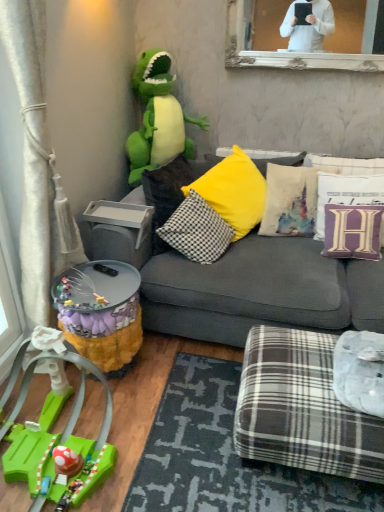
Question: Does dark gray textured mat at lower center have a larger size compared to purple velvet pillow at upper right, arranged as the fourth pillow when viewed from the left?

Choices:
 (A) yes
 (B) no

Answer: (A)

Question: From a real-world perspective, is dark gray textured mat at lower center beneath purple velvet pillow at upper right, the first pillow from the right?

Choices:
 (A) yes
 (B) no

Answer: (A)

Question: Is dark gray textured mat at lower center not inside purple velvet pillow at upper right, the first pillow from the right?

Choices:
 (A) no
 (B) yes

Answer: (B)

Question: Can purple velvet pillow at upper right, arranged as the fourth pillow when viewed from the left, be found inside dark gray textured mat at lower center?

Choices:
 (A) yes
 (B) no

Answer: (B)

Question: Can you confirm if dark gray textured mat at lower center is shorter than purple velvet pillow at upper right, arranged as the fourth pillow when viewed from the left?

Choices:
 (A) yes
 (B) no

Answer: (A)

Question: Does point (52, 492) appear closer or farther from the camera than point (241, 394)?

Choices:
 (A) closer
 (B) farther

Answer: (A)

Question: From the image's perspective, is green plastic race track at lower left, arranged as the first toy when ordered from the bottom, located above or below plaid fabric ottoman at lower right?

Choices:
 (A) below
 (B) above

Answer: (A)

Question: Looking at the image, does green plastic race track at lower left, acting as the second toy starting from the back, seem bigger or smaller compared to plaid fabric ottoman at lower right?

Choices:
 (A) small
 (B) big

Answer: (B)

Question: From a real-world perspective, is green plastic race track at lower left, acting as the second toy starting from the back, positioned above or below plaid fabric ottoman at lower right?

Choices:
 (A) below
 (B) above

Answer: (B)

Question: Considering the relative positions of dark gray textured mat at lower center and black-and-white checkered pillow at center, which is counted as the 4th pillow, starting from the right, in the image provided, is dark gray textured mat at lower center to the left or to the right of black-and-white checkered pillow at center, which is counted as the 4th pillow, starting from the right,?

Choices:
 (A) right
 (B) left

Answer: (B)

Question: Is dark gray textured mat at lower center situated inside black-and-white checkered pillow at center, which is counted as the 4th pillow, starting from the right, or outside?

Choices:
 (A) inside
 (B) outside

Answer: (B)

Question: In terms of height, does dark gray textured mat at lower center look taller or shorter compared to black-and-white checkered pillow at center, which is counted as the 4th pillow, starting from the right?

Choices:
 (A) tall
 (B) short

Answer: (B)

Question: From the image's perspective, relative to black-and-white checkered pillow at center, the 1th pillow from the left, is dark gray textured mat at lower center above or below?

Choices:
 (A) below
 (B) above

Answer: (A)

Question: Would you say gray fabric couch at center is to the left or to the right of textured white pillow at center right, which is the second pillow in left-to-right order, in the picture?

Choices:
 (A) left
 (B) right

Answer: (A)

Question: From the image's perspective, is gray fabric couch at center above or below textured white pillow at center right, which is the second pillow in left-to-right order?

Choices:
 (A) below
 (B) above

Answer: (A)